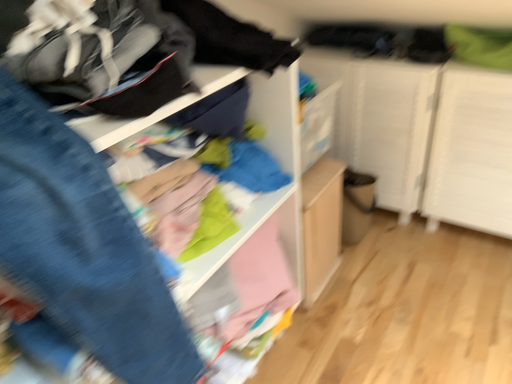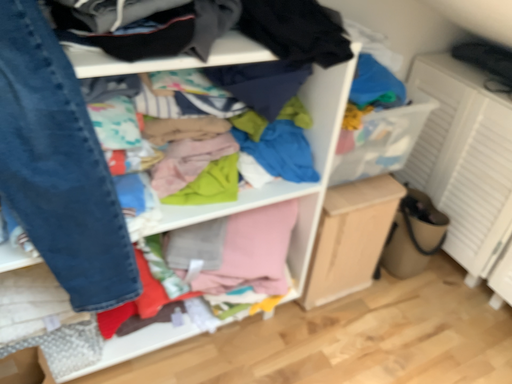
Question: How did the camera likely rotate when shooting the video?

Choices:
 (A) rotated right
 (B) rotated left

Answer: (B)